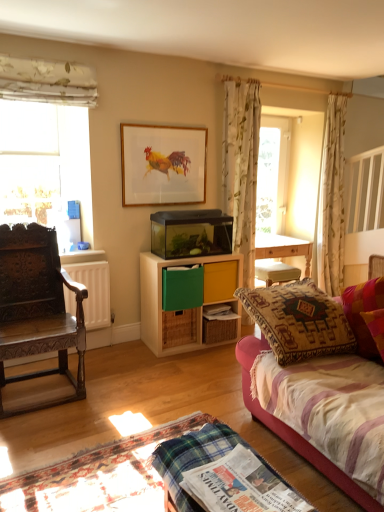
Question: Is point (355, 295) positioned closer to the camera than point (200, 181)?

Choices:
 (A) farther
 (B) closer

Answer: (B)

Question: Is velvet pink pillow at right taller or shorter than wooden framed picture of rooster at upper center?

Choices:
 (A) tall
 (B) short

Answer: (A)

Question: Which object is positioned farthest from the white floral fabric at upper left, which is the 3th curtain in right-to-left order?

Choices:
 (A) wooden framed picture of rooster at upper center
 (B) velvet pink couch at lower right
 (C) carved wood chair at left
 (D) wooden storage unit at center
 (E) green matte drawer at center, the 2th drawer ordered from the bottom

Answer: (B)

Question: Estimate the real-world distances between objects in this image. Which object is farther from the yellow matte drawer at center, which ranks as the third drawer in bottom-to-top order?

Choices:
 (A) transparent glass window at left
 (B) floral fabric curtain at center, positioned as the 2th curtain in back-to-front order
 (C) white floral curtain at upper right, which is the 1th curtain from right to left
 (D) wooden framed picture of rooster at upper center
 (E) green woven drawer at center, which is the 1th drawer in bottom-to-top order

Answer: (C)